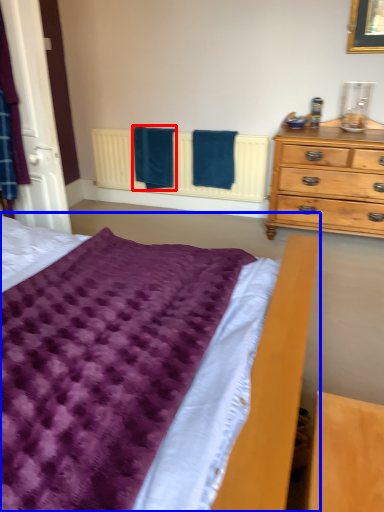
Question: Which object is further to the camera taking this photo, bath towel (highlighted by a red box) or bed (highlighted by a blue box)?

Choices:
 (A) bath towel
 (B) bed

Answer: (A)